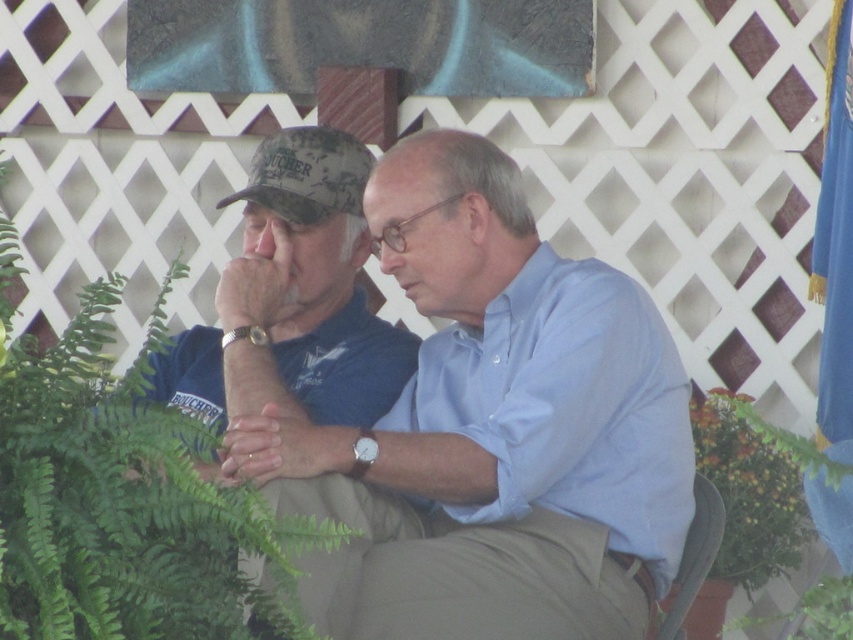
Question: Which point appears closest to the camera in this image?

Choices:
 (A) (506, 387)
 (B) (500, 464)

Answer: (B)

Question: Is green leafy plant at left bigger than camouflage fabric baseball cap at left?

Choices:
 (A) yes
 (B) no

Answer: (A)

Question: Which object is farther from the camera taking this photo?

Choices:
 (A) camouflage fabric baseball cap at left
 (B) green leafy plant at left

Answer: (A)

Question: From the image, what is the correct spatial relationship of light blue shirt at center in relation to light blue cotton shirt at center?

Choices:
 (A) right
 (B) left

Answer: (B)

Question: Considering the relative positions of light blue shirt at center and camouflage fabric baseball cap at left in the image provided, where is light blue shirt at center located with respect to camouflage fabric baseball cap at left?

Choices:
 (A) right
 (B) left

Answer: (A)

Question: Which is nearer to the light blue shirt at center?

Choices:
 (A) camouflage fabric baseball cap at left
 (B) green leafy plant at left

Answer: (B)